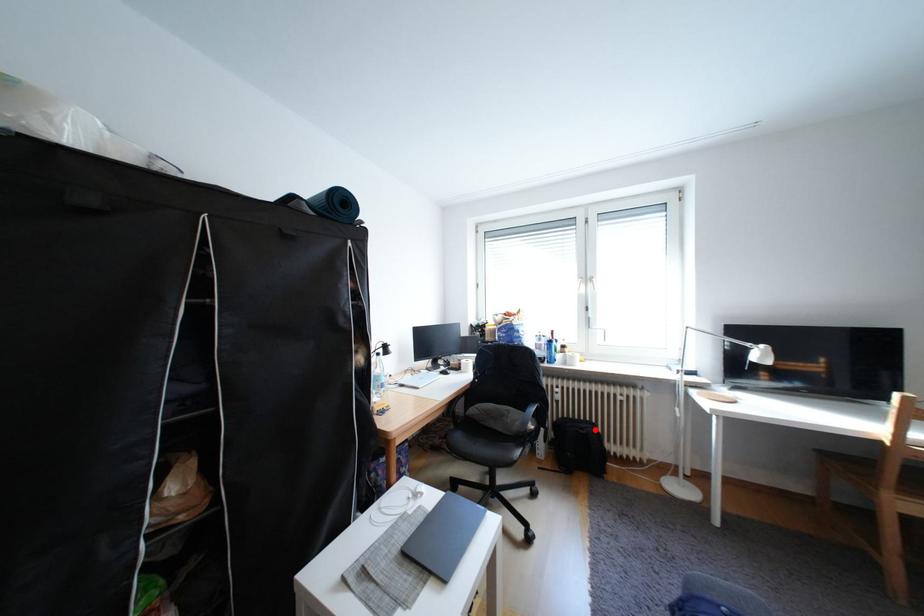
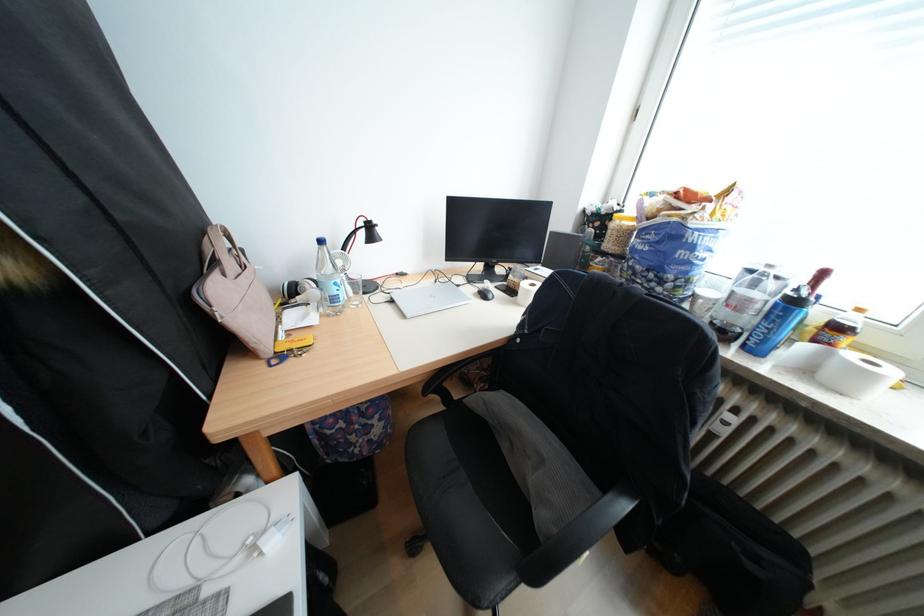
Find the pixel in the second image that matches the highlighted location in the first image.

(771, 561)